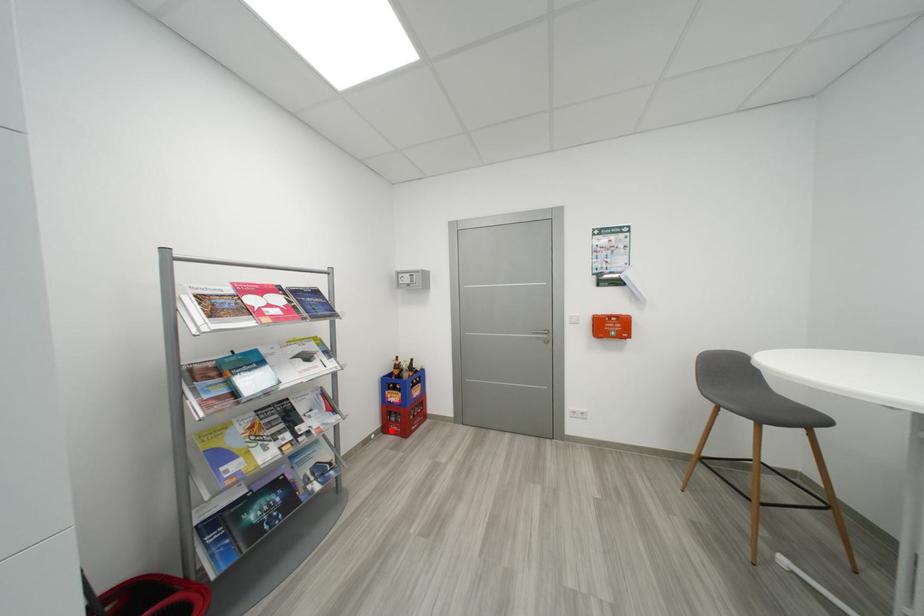
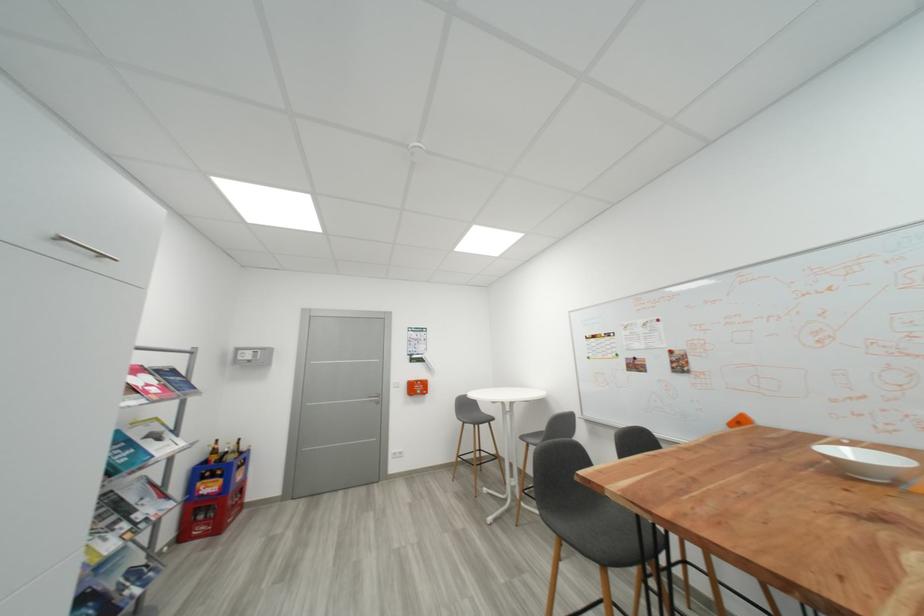
Question: I am providing you with two images of the same scene from different viewpoints. A red point is shown in image1. For the corresponding object point in image2, is it positioned nearer or farther from the camera?

Choices:
 (A) Nearer
 (B) Farther

Answer: (A)